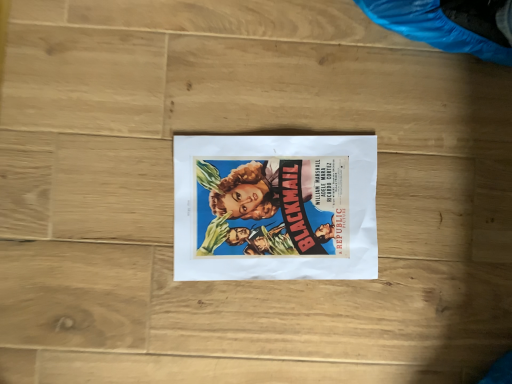
Locate an element on the screen. free point above matte paper poster at center (from a real-world perspective) is located at coordinates (277, 208).